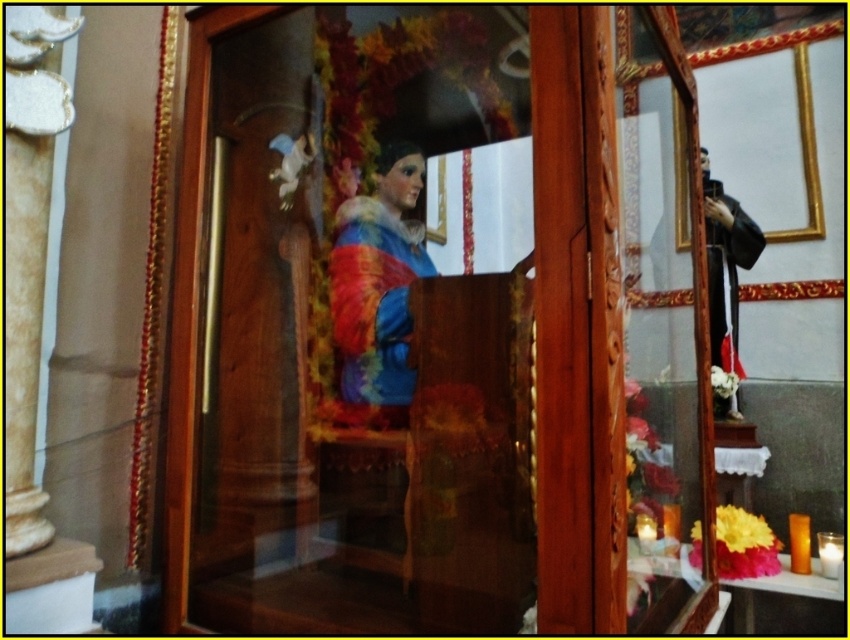
You are an interior designer planning to place a new decorative item in the center of the church. The space available is exactly the width of the transparent glass statue at center. If you choose to replace the current statue with the matte painted statue at center, will it fit without exceeding the width?

The transparent glass statue at center might be wider than matte painted statue at center, so there is a possibility that the matte painted statue at center could be narrower and fit within the available space. However, since the width difference is uncertain, there is a risk it might not fit perfectly.

You are an interior designer planning to place a new decorative item in the church. You have a small golden cross that needs to be placed near the matte painted statue at center and the black matte robe at right. Considering their sizes, where should you place the golden cross so it doesn

Since the matte painted statue at center is larger than the black matte robe at right, placing the small golden cross next to the black matte robe at right would create a better visual balance due to their similar sizes.